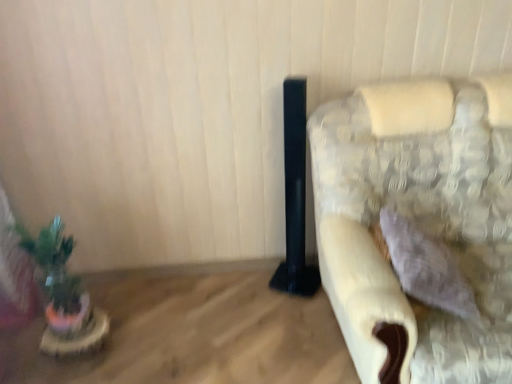
Question: From a real-world perspective, is fluffy fabric couch at right physically above wooden table at lower left?

Choices:
 (A) yes
 (B) no

Answer: (A)

Question: Is fluffy fabric couch at right facing away from wooden table at lower left?

Choices:
 (A) yes
 (B) no

Answer: (B)

Question: Is fluffy fabric couch at right positioned far away from wooden table at lower left?

Choices:
 (A) yes
 (B) no

Answer: (B)

Question: Does fluffy fabric couch at right have a lesser height compared to wooden table at lower left?

Choices:
 (A) no
 (B) yes

Answer: (A)

Question: Is fluffy fabric couch at right smaller than wooden table at lower left?

Choices:
 (A) yes
 (B) no

Answer: (B)

Question: Is fluffy fabric couch at right inside or outside of wooden table at lower left?

Choices:
 (A) outside
 (B) inside

Answer: (A)

Question: In terms of width, does fluffy fabric couch at right look wider or thinner when compared to wooden table at lower left?

Choices:
 (A) wide
 (B) thin

Answer: (B)

Question: Is fluffy fabric couch at right bigger or smaller than wooden table at lower left?

Choices:
 (A) big
 (B) small

Answer: (A)

Question: Is fluffy fabric couch at right taller or shorter than wooden table at lower left?

Choices:
 (A) tall
 (B) short

Answer: (A)

Question: Looking at their shapes, would you say wooden table at lower left is wider or thinner than green matte plant at left?

Choices:
 (A) thin
 (B) wide

Answer: (B)

Question: Looking at the image, does wooden table at lower left seem bigger or smaller compared to green matte plant at left?

Choices:
 (A) small
 (B) big

Answer: (B)

Question: Considering the positions of point (218, 294) and point (71, 307), is point (218, 294) closer or farther from the camera than point (71, 307)?

Choices:
 (A) closer
 (B) farther

Answer: (B)

Question: Would you say wooden table at lower left is inside or outside green matte plant at left?

Choices:
 (A) outside
 (B) inside

Answer: (A)

Question: Relative to fluffy fabric couch at right, is green matte plant at left in front or behind?

Choices:
 (A) front
 (B) behind

Answer: (B)

Question: Based on their positions, is green matte plant at left located to the left or right of fluffy fabric couch at right?

Choices:
 (A) right
 (B) left

Answer: (B)